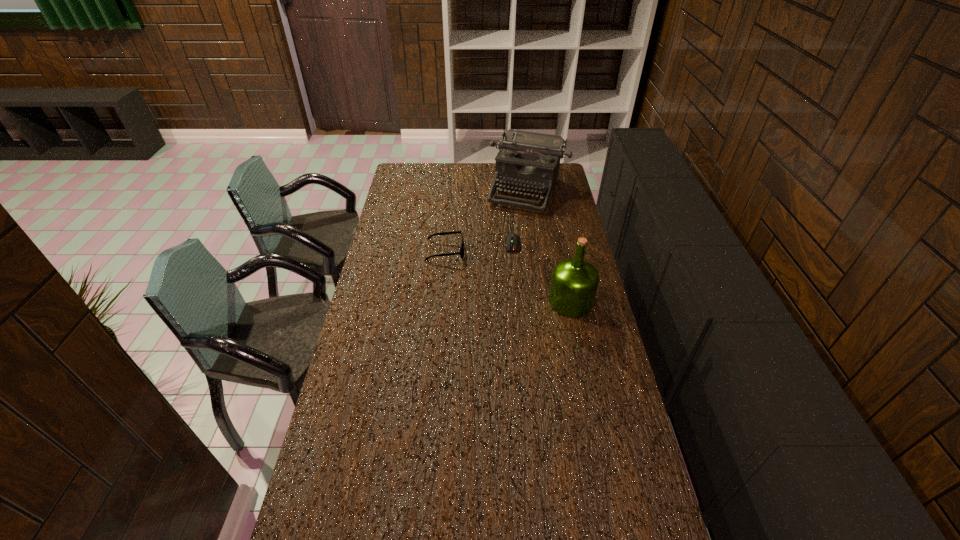
You are a GUI agent. You are given a task and a screenshot of the screen. Output one action in this format:
    pyautogui.click(x=<x>, y=<y>)
    Task: Click on the empty location between the third shortest object and the leftmost object
    Image resolution: width=960 pixels, height=540 pixels.
    Given the screenshot: What is the action you would take?
    pyautogui.click(x=487, y=220)

Find the location of a particular element. Image resolution: width=960 pixels, height=540 pixels. vacant point located between the leftmost object and the computer equipment is located at coordinates (479, 247).

You are a GUI agent. You are given a task and a screenshot of the screen. Output one action in this format:
    pyautogui.click(x=<x>, y=<y>)
    Task: Click on the unoccupied position between the tallest object and the typewriter
    
    Given the screenshot: What is the action you would take?
    pyautogui.click(x=549, y=246)

This screenshot has width=960, height=540. In order to click on vacant area that lies between the sunglasses and the farthest object in this screenshot , I will do `click(487, 220)`.

Locate an element on the screen. The width and height of the screenshot is (960, 540). vacant area that lies between the leftmost object and the typewriter is located at coordinates (487, 220).

You are a GUI agent. You are given a task and a screenshot of the screen. Output one action in this format:
    pyautogui.click(x=<x>, y=<y>)
    Task: Click on the vacant space that's between the leftmost object and the tallest object
    
    Given the screenshot: What is the action you would take?
    (x=508, y=276)

Choose which object is the third nearest neighbor to the leftmost object. Please provide its 2D coordinates. Your answer should be formatted as a tuple, i.e. [(x, y)], where the tuple contains the x and y coordinates of a point satisfying the conditions above.

[(574, 283)]

Identify which object is located as the second nearest to the shortest object. Please provide its 2D coordinates. Your answer should be formatted as a tuple, i.e. [(x, y)], where the tuple contains the x and y coordinates of a point satisfying the conditions above.

[(461, 252)]

Where is `blank space that satisfies the following two spatial constraints: 1. on the front side of the computer equipment; 2. on the right side of the olive oil`? Image resolution: width=960 pixels, height=540 pixels. blank space that satisfies the following two spatial constraints: 1. on the front side of the computer equipment; 2. on the right side of the olive oil is located at coordinates (517, 302).